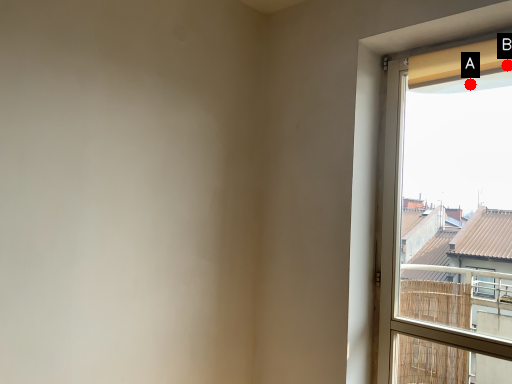
Question: Two points are circled on the image, labeled by A and B beside each circle. Which point is farther to the camera?

Choices:
 (A) A is further
 (B) B is further

Answer: (A)